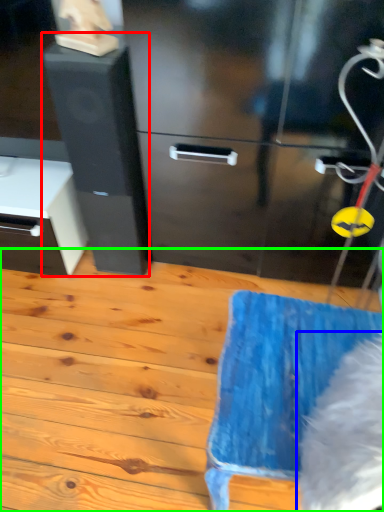
Question: Which object is positioned farthest from file cabinet (highlighted by a red box)? Select from animal (highlighted by a blue box) and wood (highlighted by a green box).

Choices:
 (A) animal
 (B) wood

Answer: (A)